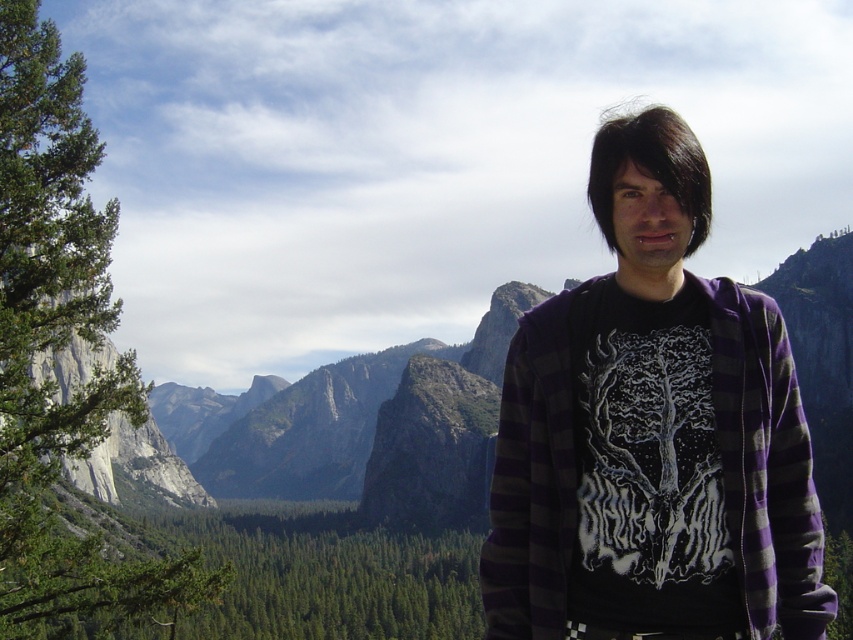
Can you confirm if purple flannel shirt at center is thinner than green leafy tree at left?

Yes.

Does point (665, 531) come behind point (82, 116)?

No, it is not.

At what (x,y) coordinates should I click in order to perform the action: click on purple flannel shirt at center. Please return your answer as a coordinate pair (x, y). The width and height of the screenshot is (853, 640). Looking at the image, I should click on (653, 433).